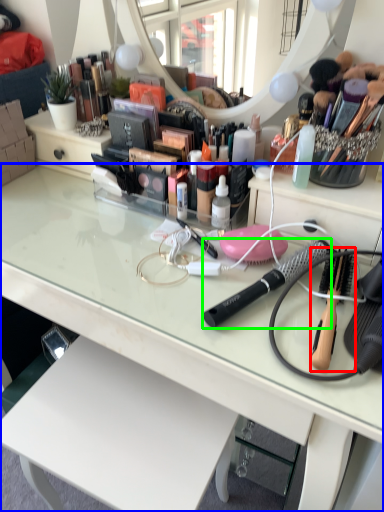
Question: Considering the real-world distances, which object is farthest from brush (highlighted by a red box)? desk (highlighted by a blue box) or brush (highlighted by a green box)?

Choices:
 (A) desk
 (B) brush

Answer: (A)